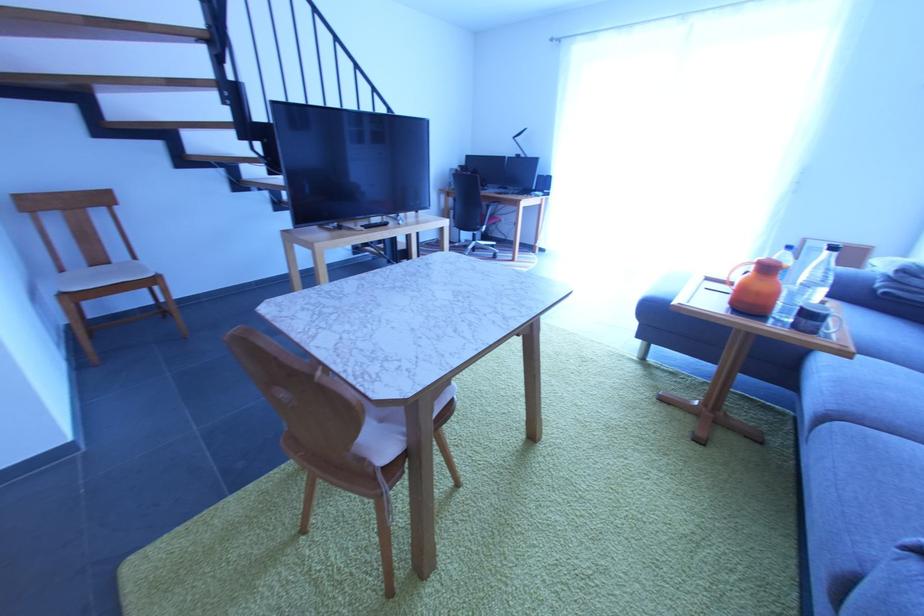
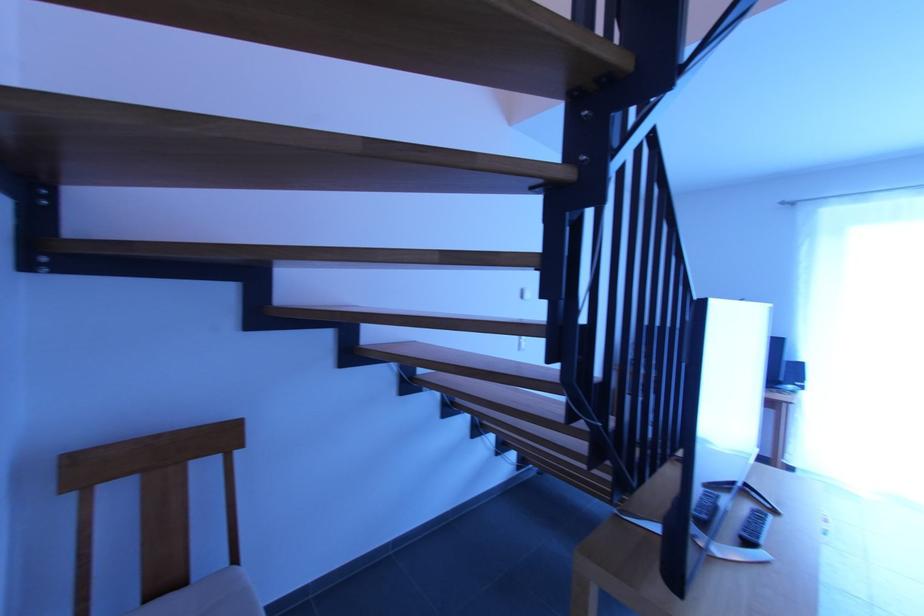
The images are taken continuously from a first-person perspective. In which direction are you moving?

The cameraman walked toward left, forward.